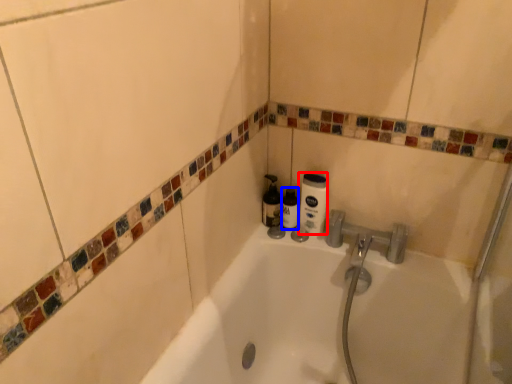
Question: Which of the following is the farthest to the observer, cleaning product (highlighted by a red box) or toiletry (highlighted by a blue box)?

Choices:
 (A) cleaning product
 (B) toiletry

Answer: (B)